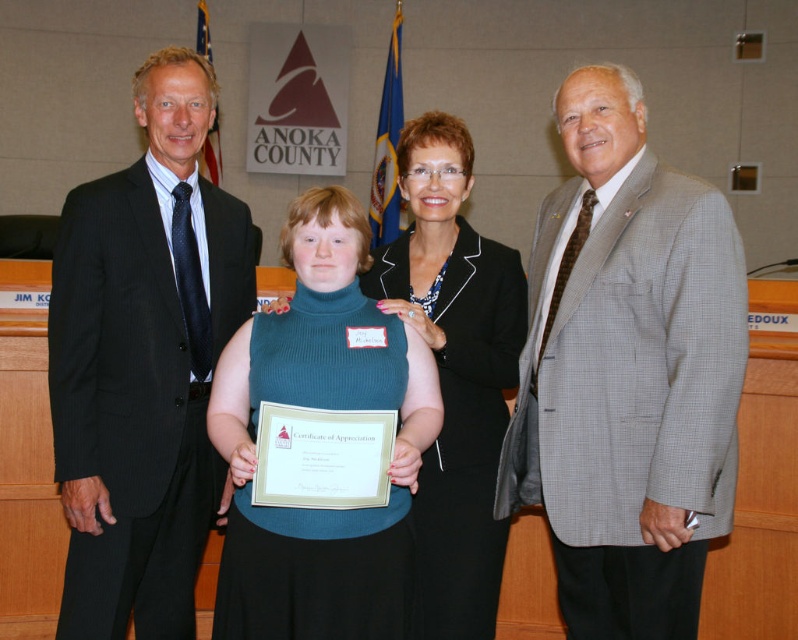
Question: Can you confirm if gray checkered suit at right is thinner than black suit at left?

Choices:
 (A) yes
 (B) no

Answer: (B)

Question: Among these objects, which one is farthest from the camera?

Choices:
 (A) gray checkered suit at right
 (B) black wool suit at center
 (C) teal turtleneck sweater at center
 (D) black suit at left

Answer: (D)

Question: Is teal turtleneck sweater at center thinner than black wool suit at center?

Choices:
 (A) no
 (B) yes

Answer: (A)

Question: Which point is closer to the camera?

Choices:
 (A) (444, 440)
 (B) (170, 161)
 (C) (392, 326)
 (D) (548, 221)

Answer: (C)

Question: Does teal turtleneck sweater at center have a lesser width compared to black wool suit at center?

Choices:
 (A) no
 (B) yes

Answer: (A)

Question: Which object is positioned farthest from the black wool suit at center?

Choices:
 (A) teal turtleneck sweater at center
 (B) black suit at left

Answer: (B)